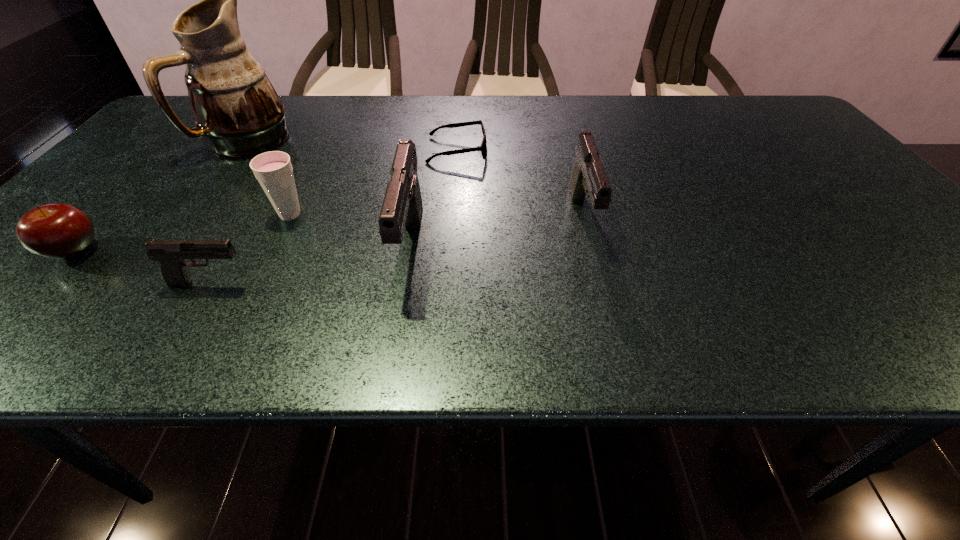
Locate an element on the screen. Image resolution: width=960 pixels, height=540 pixels. vacant point at the left edge is located at coordinates (148, 175).

This screenshot has height=540, width=960. In order to click on vacant space at the far right corner of the desktop in this screenshot , I will do `click(748, 108)`.

Find the location of a particular element. free space that is in between the second pistol from left to right and the shortest pistol is located at coordinates (310, 265).

The width and height of the screenshot is (960, 540). What are the coordinates of `free spot between the second pistol from right to left and the shortest pistol` in the screenshot? It's located at (310, 265).

The height and width of the screenshot is (540, 960). In order to click on empty space between the second pistol from right to left and the third tallest object in this screenshot , I will do `click(497, 233)`.

Where is `free space between the cup and the second pistol from right to left`? This screenshot has width=960, height=540. free space between the cup and the second pistol from right to left is located at coordinates (350, 231).

I want to click on free space between the shortest object and the shortest pistol, so click(x=334, y=217).

At what (x,y) coordinates should I click in order to perform the action: click on free spot between the sunglasses and the shortest pistol. Please return your answer as a coordinate pair (x, y). This screenshot has height=540, width=960. Looking at the image, I should click on (334, 217).

Image resolution: width=960 pixels, height=540 pixels. Identify the location of unoccupied area between the sunglasses and the second pistol from right to left. (434, 199).

You are a GUI agent. You are given a task and a screenshot of the screen. Output one action in this format:
    pyautogui.click(x=<x>, y=<y>)
    Task: Click on the blank region between the leftmost pistol and the pitcher
    
    Given the screenshot: What is the action you would take?
    pyautogui.click(x=229, y=213)